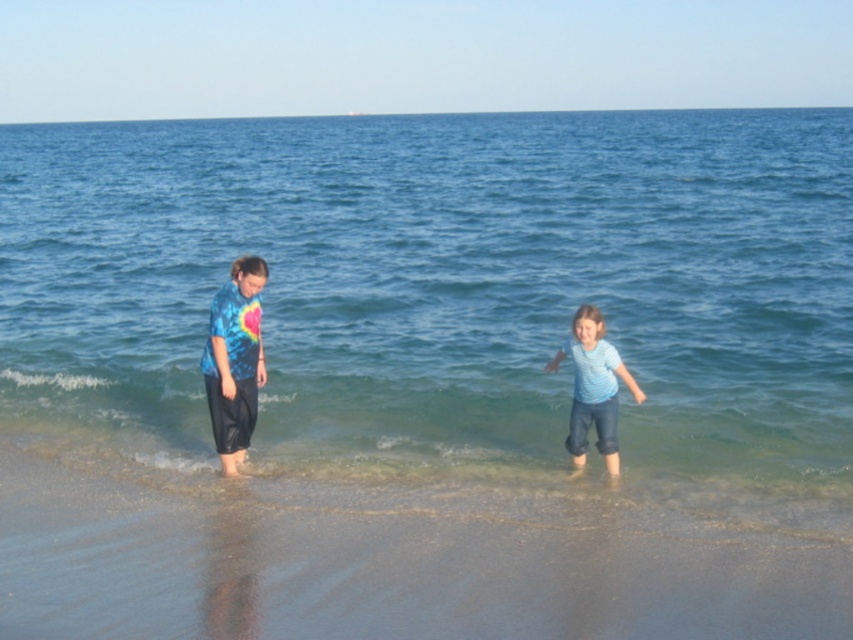
Question: Can you confirm if sandy beach at lower center is positioned below light blue denim jeans at lower center?

Choices:
 (A) no
 (B) yes

Answer: (B)

Question: Is clear blue water at center positioned at the back of sandy beach at lower center?

Choices:
 (A) yes
 (B) no

Answer: (A)

Question: Observing the image, what is the correct spatial positioning of sandy beach at lower center in reference to light blue denim jeans at lower center?

Choices:
 (A) right
 (B) left

Answer: (B)

Question: Which object is the closest to the clear blue water at center?

Choices:
 (A) tie-dye fabric pants at left
 (B) light blue denim jeans at lower center
 (C) sandy beach at lower center

Answer: (B)

Question: Based on their relative distances, which object is farther from the sandy beach at lower center?

Choices:
 (A) tie-dye fabric pants at left
 (B) clear blue water at center
 (C) light blue denim jeans at lower center

Answer: (B)

Question: Which is farther from the clear blue water at center?

Choices:
 (A) sandy beach at lower center
 (B) tie-dye fabric pants at left
 (C) light blue denim jeans at lower center

Answer: (A)